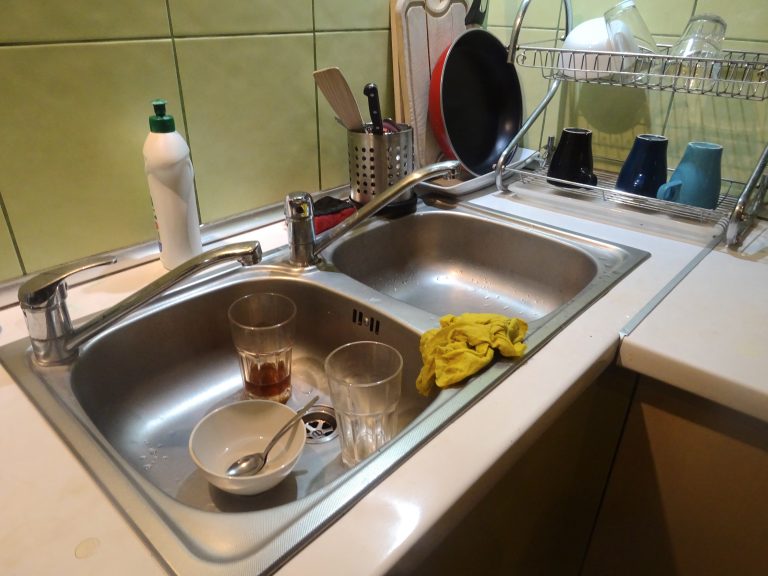
You are a GUI agent. You are given a task and a screenshot of the screen. Output one action in this format:
    pyautogui.click(x=<x>, y=<y>)
    Task: Click on the soap bottle
    This screenshot has width=768, height=576.
    Given the screenshot: What is the action you would take?
    pyautogui.click(x=170, y=185)